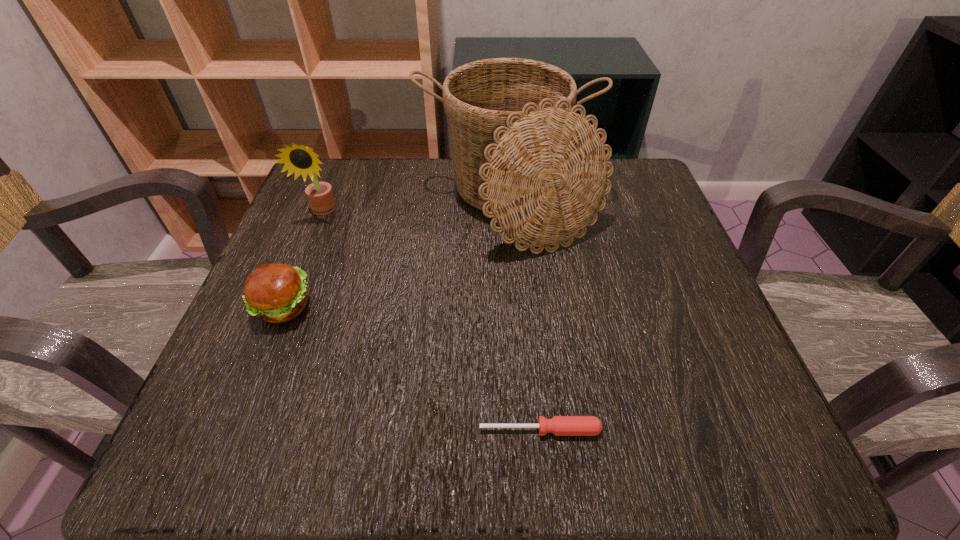
The width and height of the screenshot is (960, 540). Find the location of `vacant region between the third tallest object and the shortest object`. vacant region between the third tallest object and the shortest object is located at coordinates 412,368.

Identify the location of free space between the sunflower and the basket. (416, 207).

Image resolution: width=960 pixels, height=540 pixels. Identify the location of free space that is in between the second tallest object and the hamburger. (302, 259).

This screenshot has height=540, width=960. I want to click on vacant area that lies between the sunflower and the third farthest object, so click(302, 259).

This screenshot has width=960, height=540. I want to click on vacant area between the tallest object and the shortest object, so click(524, 316).

Choose which object is the second nearest neighbor to the third tallest object. Please provide its 2D coordinates. Your answer should be formatted as a tuple, i.e. [(x, y)], where the tuple contains the x and y coordinates of a point satisfying the conditions above.

[(302, 160)]

I want to click on object that ranks as the second closest to the shortest object, so click(276, 293).

At what (x,y) coordinates should I click in order to perform the action: click on vacant point that satisfies the following two spatial constraints: 1. on the face of the sunflower; 2. on the right side of the screwdriver. Please return your answer as a coordinate pair (x, y). Image resolution: width=960 pixels, height=540 pixels. Looking at the image, I should click on (234, 430).

You are a GUI agent. You are given a task and a screenshot of the screen. Output one action in this format:
    pyautogui.click(x=<x>, y=<y>)
    Task: Click on the vacant space that satisfies the following two spatial constraints: 1. on the back side of the second shortest object; 2. on the left side of the basket
    The image size is (960, 540).
    Given the screenshot: What is the action you would take?
    pyautogui.click(x=325, y=203)

Identify the location of vacant area in the image that satisfies the following two spatial constraints: 1. on the back side of the hamburger; 2. on the right side of the basket. (325, 203).